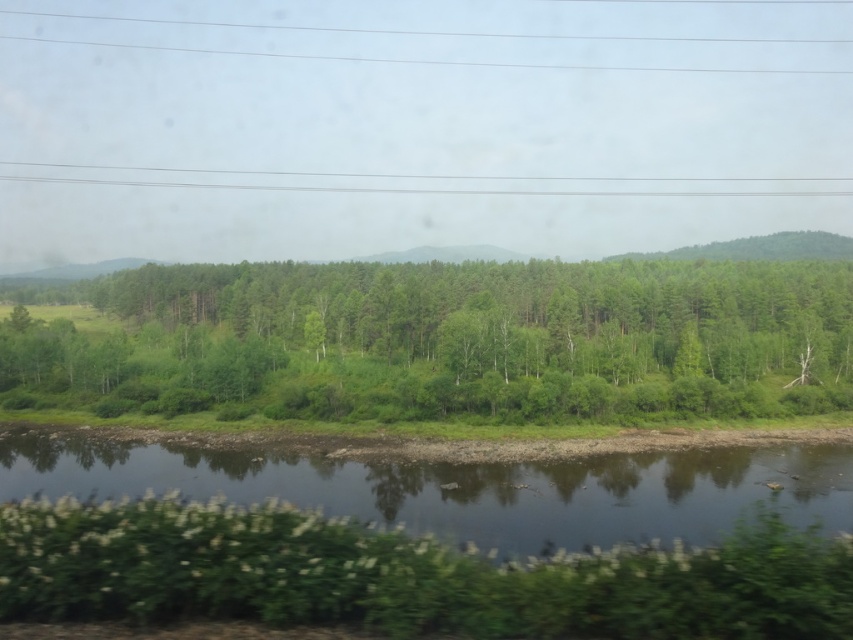
Question: Can you confirm if green grassy river at lower center is positioned below clear plastic power lines at upper center?

Choices:
 (A) no
 (B) yes

Answer: (B)

Question: Which point is closer to the camera?

Choices:
 (A) (368, 464)
 (B) (677, 340)
 (C) (212, 173)

Answer: (A)

Question: Estimate the real-world distances between objects in this image. Which object is closer to the clear plastic power lines at upper center?

Choices:
 (A) green leafy trees at center
 (B) green grassy river at lower center

Answer: (A)

Question: Which object is positioned closest to the green leafy trees at center?

Choices:
 (A) green grassy river at lower center
 (B) clear plastic power lines at upper center

Answer: (A)

Question: Can you confirm if green grassy river at lower center is smaller than clear plastic power lines at upper center?

Choices:
 (A) no
 (B) yes

Answer: (B)

Question: Is green grassy river at lower center positioned at the back of clear plastic power lines at upper center?

Choices:
 (A) no
 (B) yes

Answer: (A)